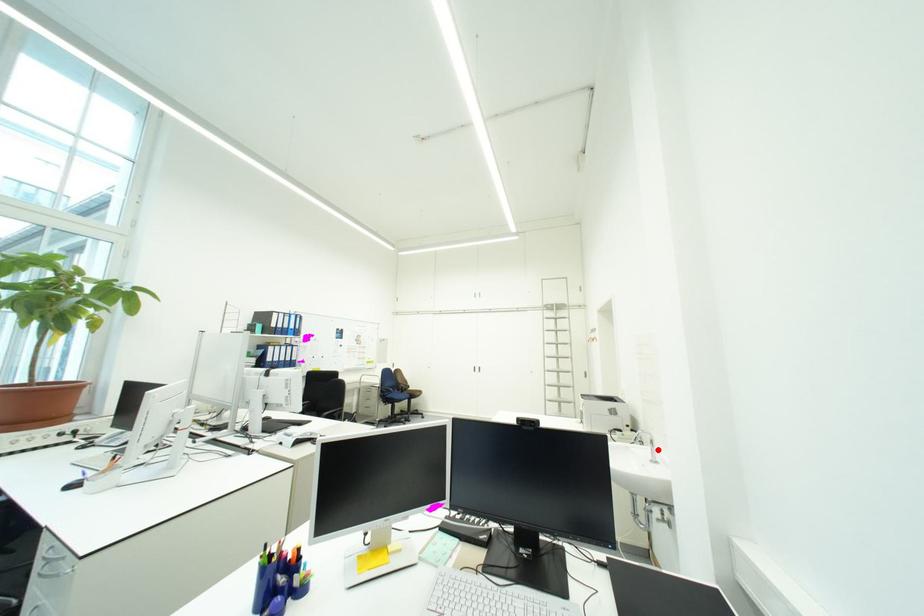
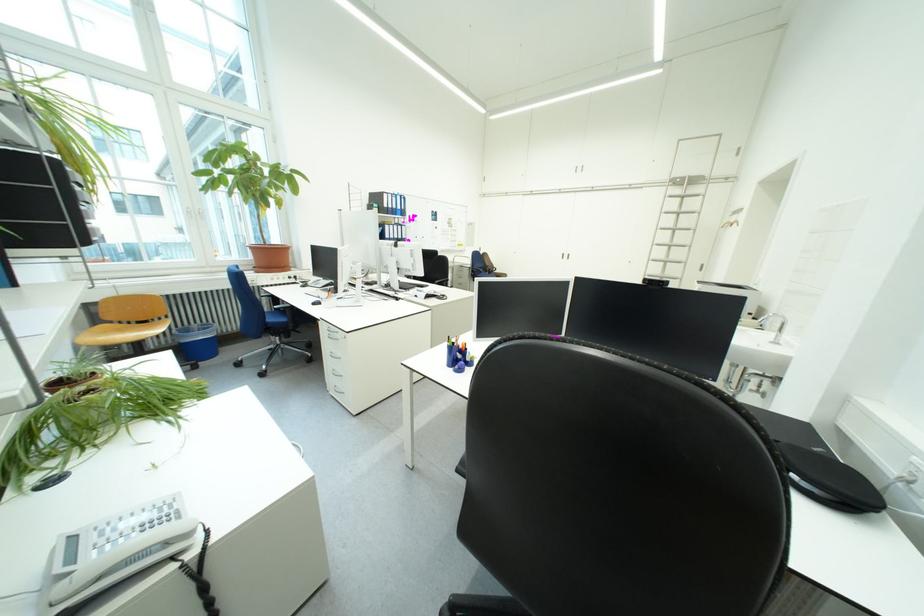
Where in the second image is the point corresponding to the highlighted location from the first image?

(780, 336)